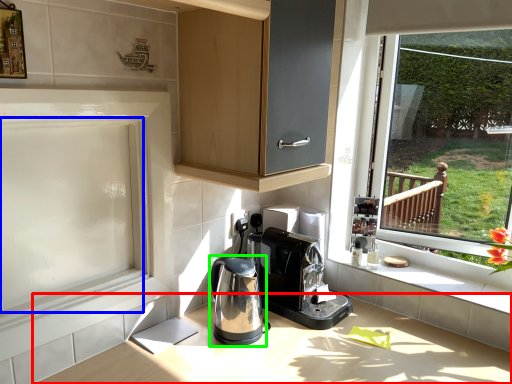
Question: Considering the real-world distances, which object is farthest from countertop (highlighted by a red box)? screen door (highlighted by a blue box) or home appliance (highlighted by a green box)?

Choices:
 (A) screen door
 (B) home appliance

Answer: (A)